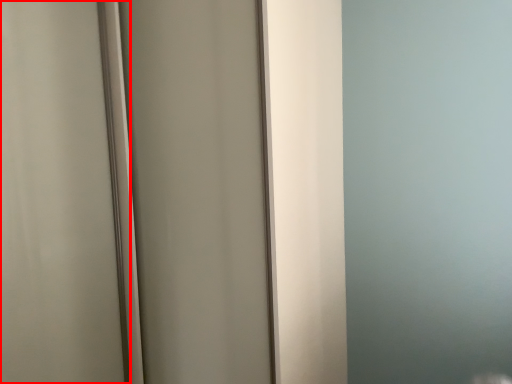
Question: From the image, what is the correct spatial relationship of screen door (annotated by the red box) in relation to screen door?

Choices:
 (A) right
 (B) left

Answer: (B)